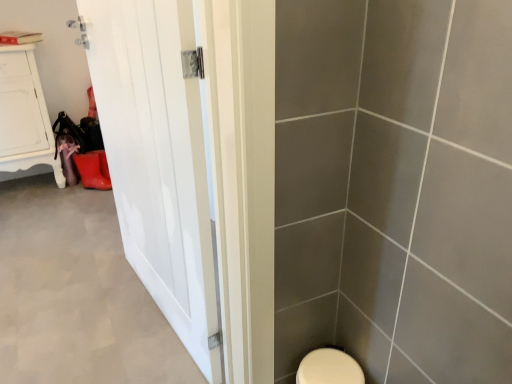
Question: Would you say white matte door at left is to the left or to the right of white glossy door at left in the picture?

Choices:
 (A) right
 (B) left

Answer: (B)

Question: In terms of height, does white matte door at left look taller or shorter compared to white glossy door at left?

Choices:
 (A) tall
 (B) short

Answer: (B)

Question: Based on their relative distances, which object is farther from the white glossy door at left?

Choices:
 (A) white matte door at left
 (B) white wood cabinet at upper left

Answer: (B)

Question: Considering the real-world distances, which object is closest to the white glossy door at left?

Choices:
 (A) white matte door at left
 (B) white wood cabinet at upper left

Answer: (A)